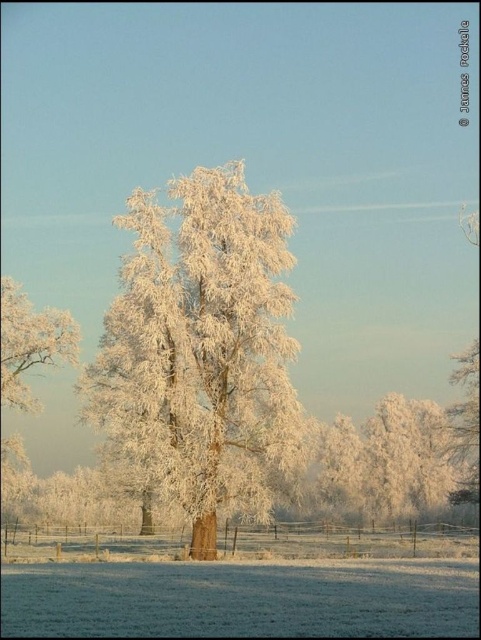
Can you confirm if frosted white tree at center is wider than frosty white tree at left?

Yes.

Who is taller, frosted white tree at center or frosty white tree at left?

frosted white tree at center

In order to click on frosted white tree at center in this screenshot , I will do `click(202, 348)`.

This screenshot has height=640, width=481. In order to click on frosted white tree at center in this screenshot , I will do tap(202, 348).